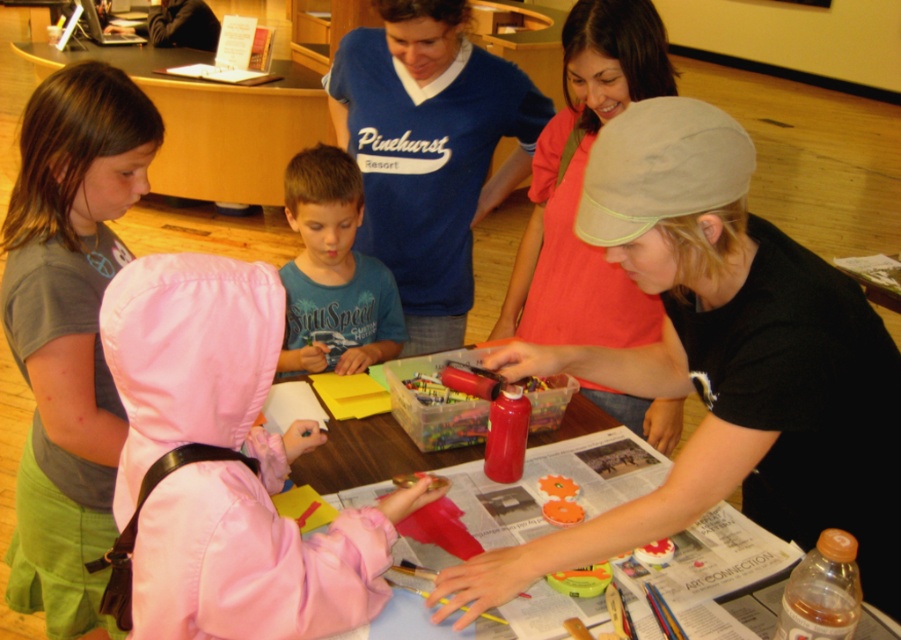
You are organizing a craft activity and need to place a large craft kit on the wooden table at lower center. Considering the blue cotton shirt at center is already on the table, will there be enough space for the kit?

The wooden table at lower center is bigger than the blue cotton shirt at center, so there should be enough space to place the large craft kit on the table.